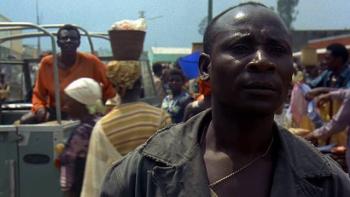
Where is `brown bucket`? brown bucket is located at coordinates (127, 40).